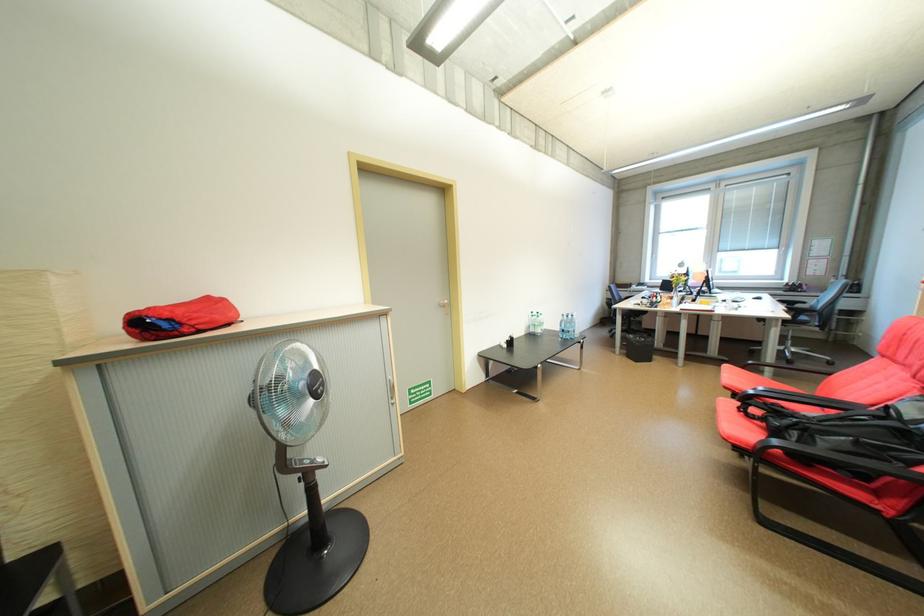
The image size is (924, 616). I want to click on black chair armrest, so click(793, 446).